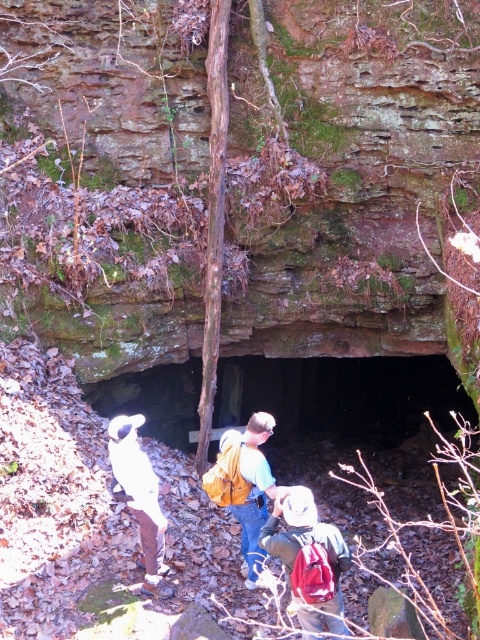
Question: Estimate the real-world distances between objects in this image. Which object is farther from the green fabric backpack at center?

Choices:
 (A) yellow backpack at center
 (B) white fabric shirt at center

Answer: (B)

Question: Can you confirm if green fabric backpack at center is positioned to the left of yellow backpack at center?

Choices:
 (A) yes
 (B) no

Answer: (B)

Question: Which point is farther to the camera?

Choices:
 (A) white fabric shirt at center
 (B) green fabric backpack at center

Answer: (A)

Question: Is yellow backpack at center to the right of white fabric shirt at center from the viewer's perspective?

Choices:
 (A) no
 (B) yes

Answer: (B)

Question: Can you confirm if green fabric backpack at center is wider than yellow backpack at center?

Choices:
 (A) yes
 (B) no

Answer: (A)

Question: Which object appears farthest from the camera in this image?

Choices:
 (A) white fabric shirt at center
 (B) green fabric backpack at center
 (C) yellow backpack at center

Answer: (C)